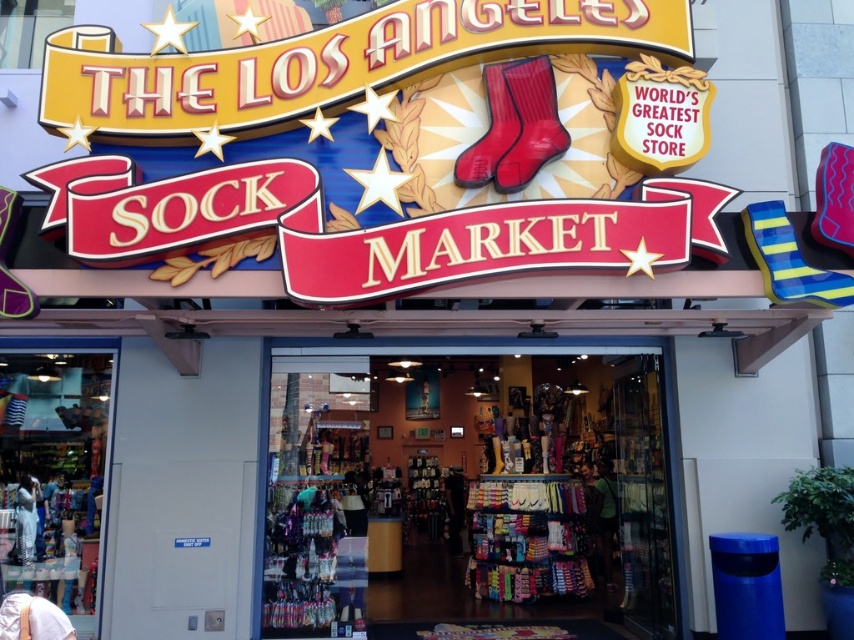
Is multicolored fabric socks at center behind matte white dress at lower left?

Yes, multicolored fabric socks at center is further from the viewer.

Can you confirm if multicolored fabric socks at center is wider than matte white dress at lower left?

In fact, multicolored fabric socks at center might be narrower than matte white dress at lower left.

This screenshot has height=640, width=854. Identify the location of multicolored fabric socks at center. (463, 477).

Locate an element on the screen. Image resolution: width=854 pixels, height=640 pixels. multicolored fabric socks at center is located at coordinates (463, 477).

Between multicolored fabric socks at center and rubberized red boot at upper center, which one appears on the right side from the viewer's perspective?

multicolored fabric socks at center

Does point (553, 593) lie in front of point (527, 147)?

That is False.

Is point (454, 388) farther from camera compared to point (516, 100)?

Yes.

Where is `multicolored fabric socks at center`? The height and width of the screenshot is (640, 854). multicolored fabric socks at center is located at coordinates (463, 477).

Who is taller, rubberized red boot at upper center or matte white dress at lower left?

Standing taller between the two is rubberized red boot at upper center.

Is rubberized red boot at upper center smaller than matte white dress at lower left?

Incorrect, rubberized red boot at upper center is not smaller in size than matte white dress at lower left.

At what (x,y) coordinates should I click in order to perform the action: click on rubberized red boot at upper center. Please return your answer as a coordinate pair (x, y). This screenshot has width=854, height=640. Looking at the image, I should click on (529, 122).